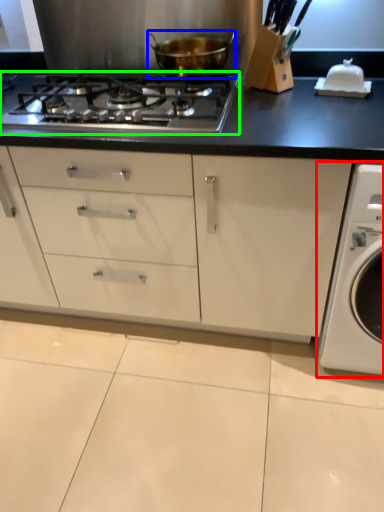
Question: Considering the real-world distances, which object is farthest from washing machine (highlighted by a red box)? kitchen appliance (highlighted by a blue box) or gas stove (highlighted by a green box)?

Choices:
 (A) kitchen appliance
 (B) gas stove

Answer: (A)